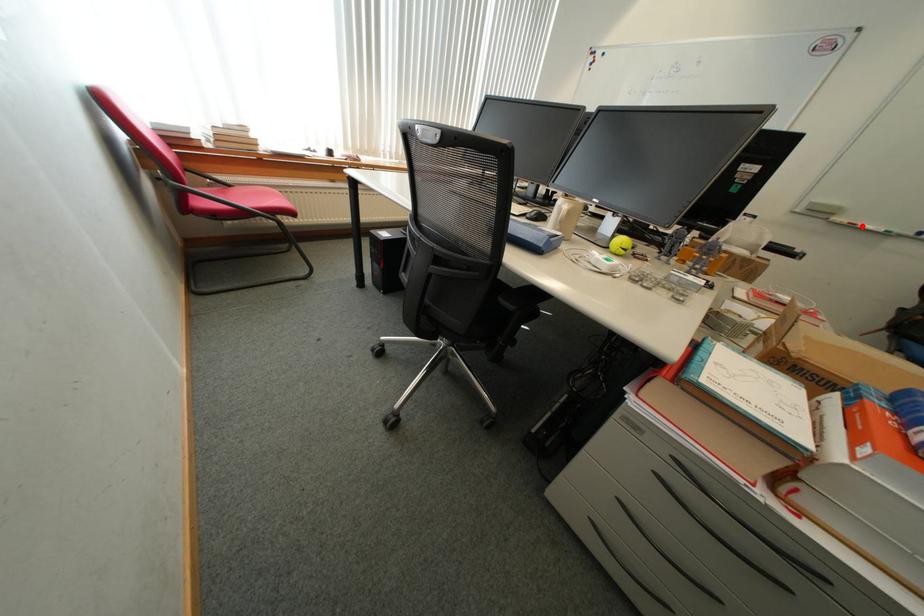
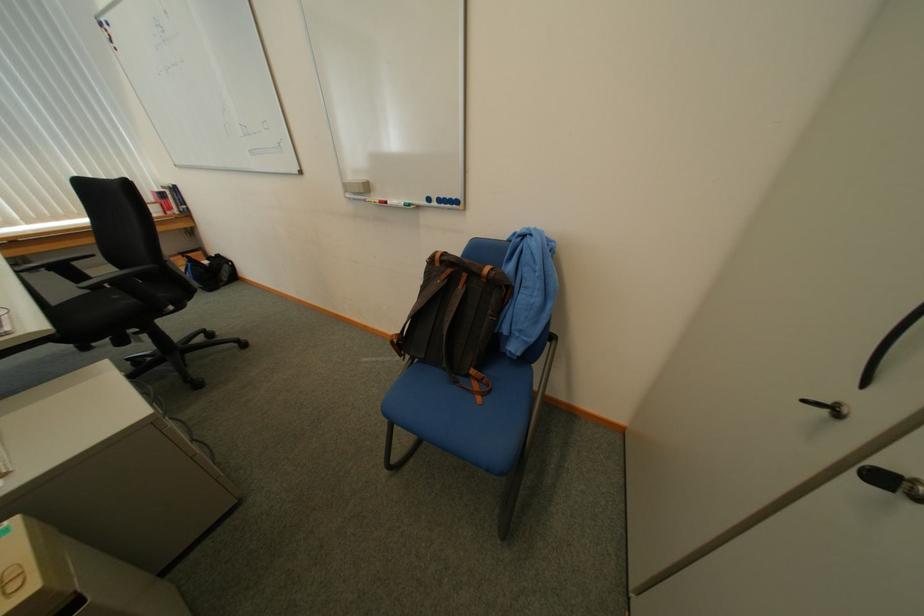
The point at the highlighted location is marked in the first image. Where is the corresponding point in the second image?

(396, 204)